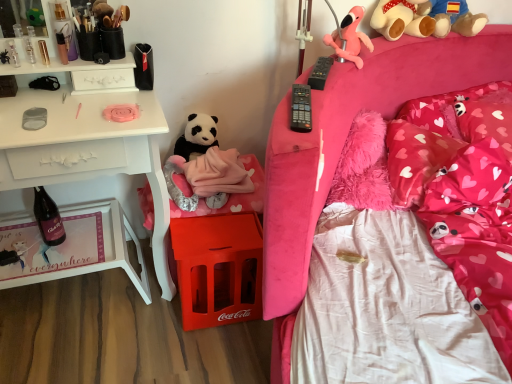
At what (x,y) coordinates should I click in order to perform the action: click on blank space situated above red plastic crate at lower center (from a real-world perspective). Please return your answer as a coordinate pair (x, y). The height and width of the screenshot is (384, 512). Looking at the image, I should click on (218, 225).